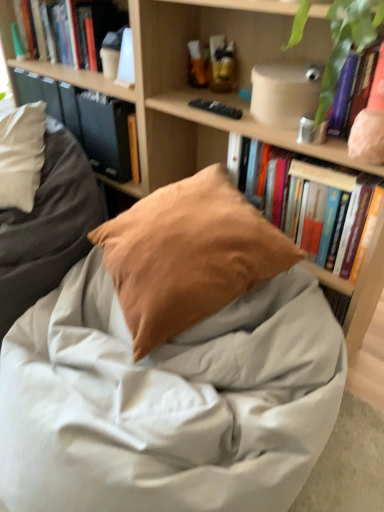
Question: Is hardcover book at upper left wider or thinner than matte beige container at upper right?

Choices:
 (A) thin
 (B) wide

Answer: (A)

Question: From the image's perspective, is hardcover book at upper left located above or below matte beige container at upper right?

Choices:
 (A) below
 (B) above

Answer: (B)

Question: Based on their relative distances, which object is farther from the matte brown pillow at center?

Choices:
 (A) hardcover book at upper right, the 2th book viewed from the left
 (B) green leafy plant at upper right
 (C) matte beige container at upper right
 (D) wooden bookshelf at center
 (E) hardcover book at upper left, the second book when ordered from bottom to top

Answer: (B)

Question: Estimate the real-world distances between objects in this image. Which object is closer to the suede-like tan pillow at center?

Choices:
 (A) hardcover book at upper right, positioned as the second book in top-to-bottom order
 (B) wooden bookshelf at center
 (C) matte brown pillow at center
 (D) hardcover book at upper left
 (E) light gray cotton blanket at center

Answer: (E)